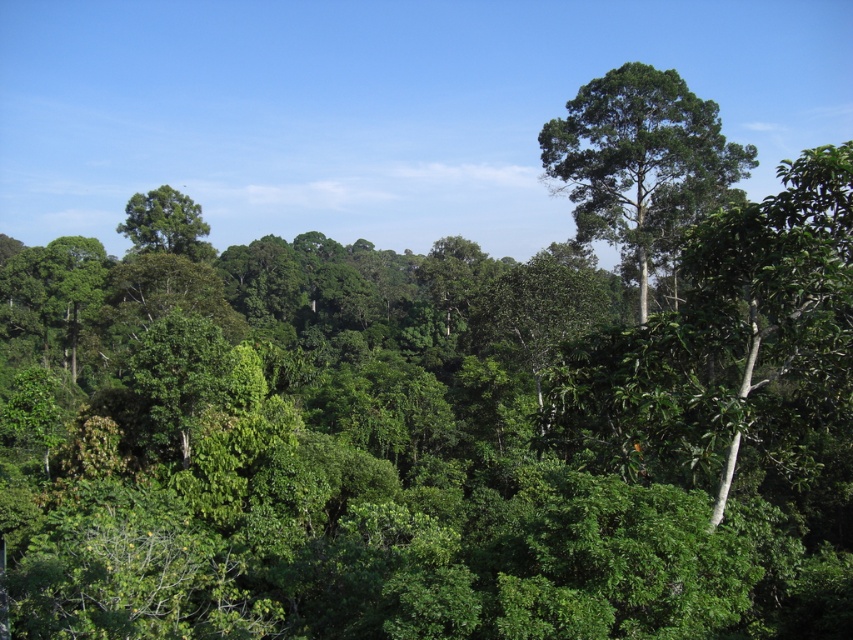
Does point (630, 150) lie in front of point (129, 204)?

Yes, point (630, 150) is in front of point (129, 204).

Can you confirm if green leafy tree at upper right is positioned above green leafy tree at upper left?

Actually, green leafy tree at upper right is below green leafy tree at upper left.

Between point (642, 125) and point (177, 209), which one is positioned behind?

Point (177, 209)

Locate an element on the screen. The height and width of the screenshot is (640, 853). green leafy tree at upper right is located at coordinates (640, 163).